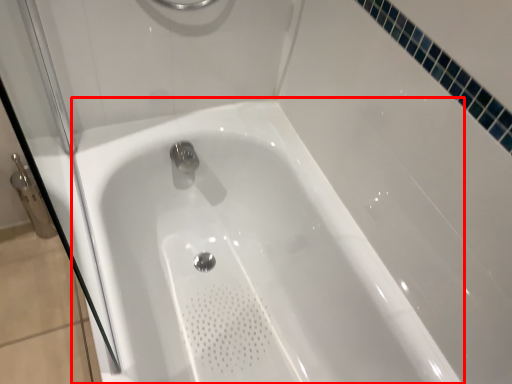
Question: From the image's perspective, considering the relative positions of bathtub (annotated by the red box) and shower door in the image provided, where is bathtub (annotated by the red box) located with respect to the staircase?

Choices:
 (A) above
 (B) below

Answer: (B)